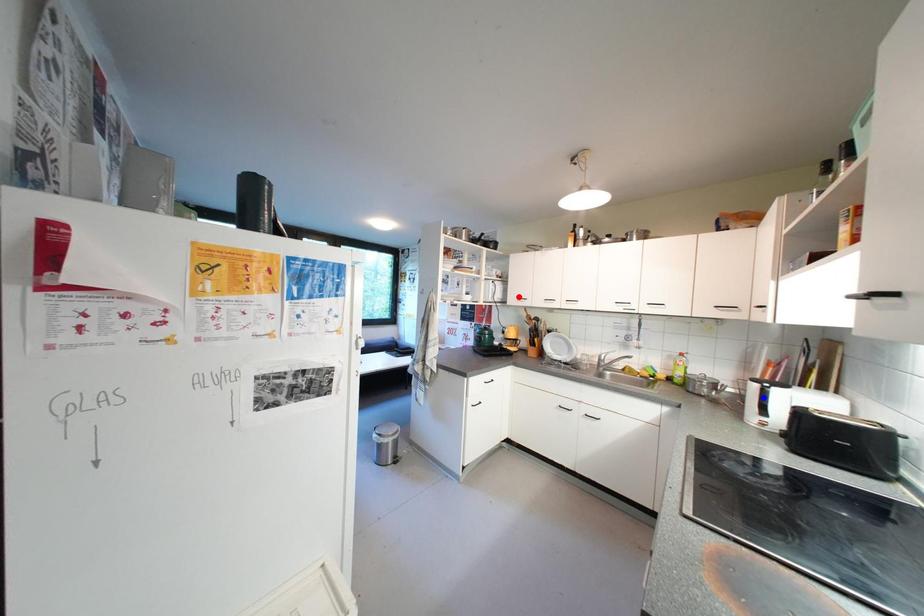
Question: Two points are marked on the image. Which point is closer to the camera?

Choices:
 (A) Blue point is closer.
 (B) Red point is closer.

Answer: (A)